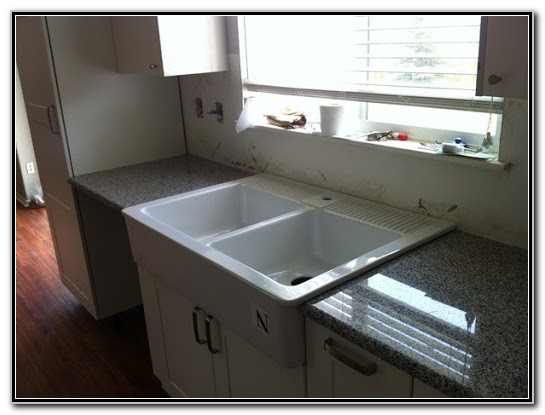
This screenshot has height=415, width=545. I want to click on grey and white counter top, so click(x=466, y=285).